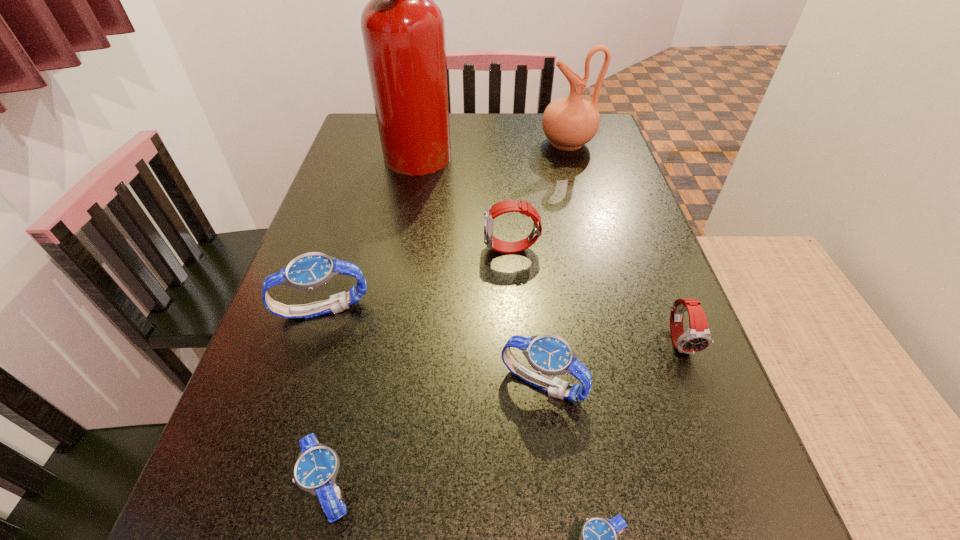
Find the location of `vacant space at the left edge of the desktop`. vacant space at the left edge of the desktop is located at coordinates (358, 207).

I want to click on free spot at the right edge of the desktop, so (x=601, y=245).

Identify the location of free spot at the far left corner of the desktop. (355, 125).

Locate an element on the screen. free space at the near left corner of the desktop is located at coordinates (209, 537).

Where is `vacant area that lies between the second tallest object and the left red watch`? This screenshot has width=960, height=540. vacant area that lies between the second tallest object and the left red watch is located at coordinates (540, 197).

At what (x,y) coordinates should I click in order to perform the action: click on free space between the farthest blue watch and the smaller red watch. Please return your answer as a coordinate pair (x, y). This screenshot has width=960, height=540. Looking at the image, I should click on (502, 325).

In order to click on free point between the third smallest blue watch and the fire extinguisher in this screenshot , I will do `click(481, 267)`.

This screenshot has width=960, height=540. Identify the location of free space between the third smallest blue watch and the tallest object. (481, 267).

Where is `vacant region between the second shortest object and the second tallest object`? The width and height of the screenshot is (960, 540). vacant region between the second shortest object and the second tallest object is located at coordinates (448, 315).

You are a GUI agent. You are given a task and a screenshot of the screen. Output one action in this format:
    pyautogui.click(x=<x>, y=<y>)
    Task: Click on the free space between the second smallest blue watch and the left red watch
    
    Given the screenshot: What is the action you would take?
    pyautogui.click(x=420, y=368)